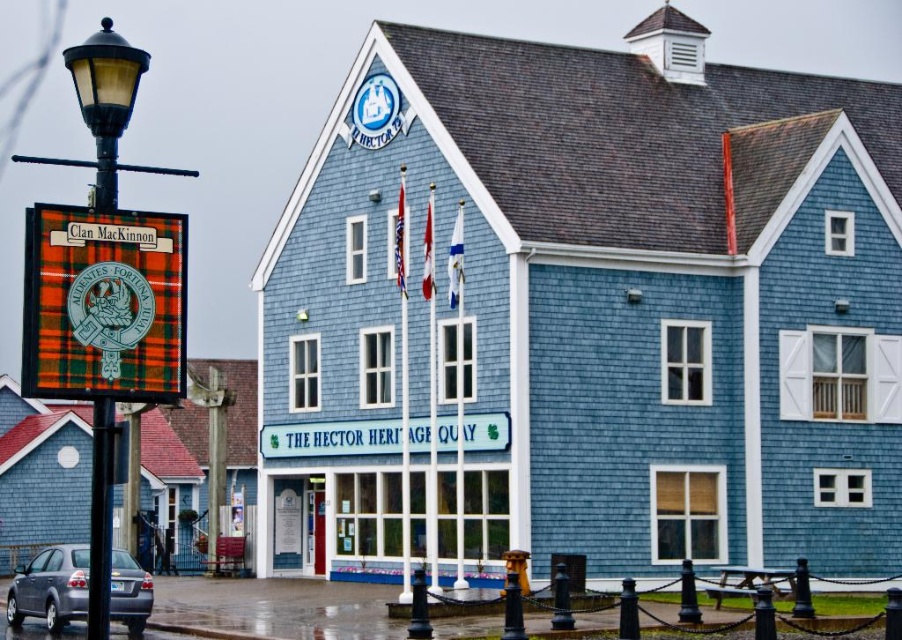
What do you see at coordinates (51, 588) in the screenshot? This screenshot has height=640, width=902. I see `metallic gray sedan at lower left` at bounding box center [51, 588].

Is point (120, 616) behind point (451, 260)?

No.

Find the location of a particular element. metallic gray sedan at lower left is located at coordinates (51, 588).

Who is positioned more to the right, metallic gray sedan at lower left or plaid fabric sign at center?

plaid fabric sign at center is more to the right.

Does metallic gray sedan at lower left have a greater width compared to plaid fabric sign at center?

Yes, metallic gray sedan at lower left is wider than plaid fabric sign at center.

Identify the location of metallic gray sedan at lower left. The width and height of the screenshot is (902, 640). (51, 588).

Where is `metallic gray sedan at lower left`? metallic gray sedan at lower left is located at coordinates (51, 588).

This screenshot has height=640, width=902. I want to click on plaid fabric clan mackinnon sign at left, so click(103, 305).

Find the location of `plaid fabric clan mackinnon sign at left`. plaid fabric clan mackinnon sign at left is located at coordinates (103, 305).

At what (x,y) coordinates should I click in order to perform the action: click on plaid fabric clan mackinnon sign at left. Please return your answer as a coordinate pair (x, y). Looking at the image, I should click on (103, 305).